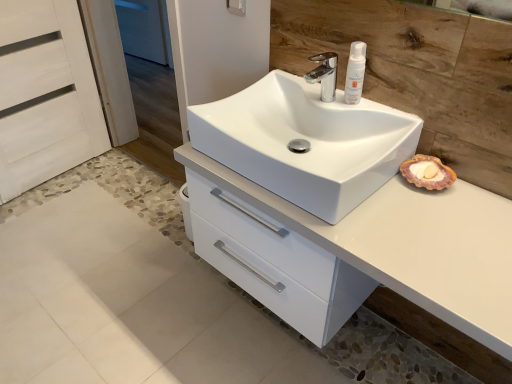
Locate an element on the screen. vacant space underneath white wood screen door at left, which is counted as the 2th screen door, starting from the right (from a real-world perspective) is located at coordinates (59, 175).